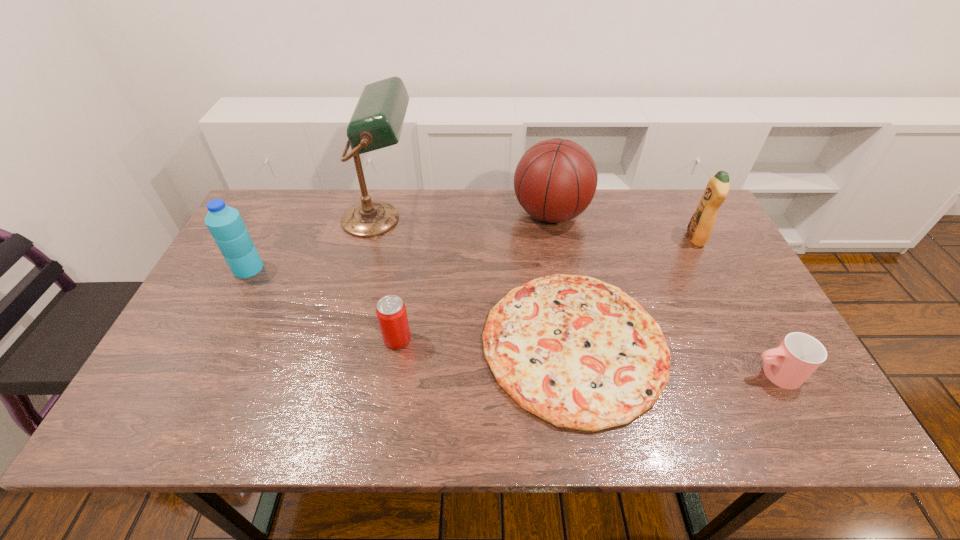
Locate an element on the screen. Image resolution: width=960 pixels, height=540 pixels. the tallest object is located at coordinates coord(377,121).

What are the coordinates of `basketball` in the screenshot? It's located at (555, 180).

At what (x,y) coordinates should I click in order to perform the action: click on detergent. Please return your answer as a coordinate pair (x, y). Looking at the image, I should click on (699, 229).

Where is `water bottle`? This screenshot has height=540, width=960. water bottle is located at coordinates (225, 224).

I want to click on can, so click(391, 311).

Locate an element on the screen. the sixth tallest object is located at coordinates (790, 364).

At what (x,y) coordinates should I click in order to perform the action: click on pizza. Please return your answer as a coordinate pair (x, y). This screenshot has width=960, height=540. Looking at the image, I should click on (580, 353).

Locate an element on the screen. vacant space located above the green lampshade of the table lamp is located at coordinates point(455,219).

Find the location of a particular element. vacant space located on the left of the basketball is located at coordinates (491, 214).

Where is `vacant region located 0.360m on the label of the detergent`? vacant region located 0.360m on the label of the detergent is located at coordinates (569, 238).